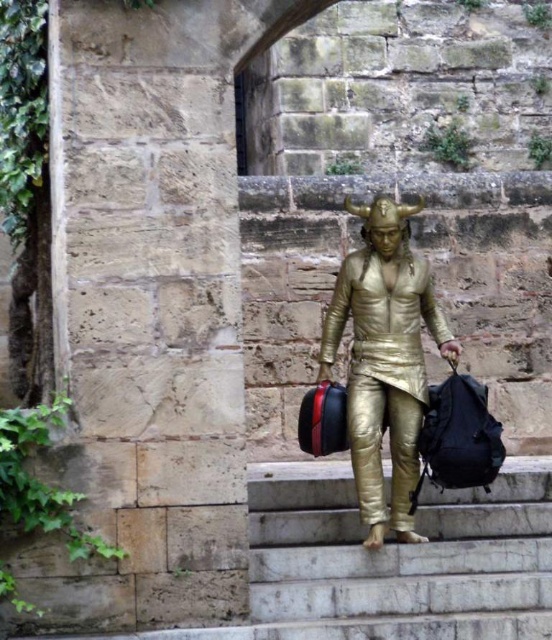
Between gold metallic suit at center and shiny metallic bag at center, which one has more height?

gold metallic suit at center is taller.

Which is more to the right, gold metallic suit at center or shiny metallic bag at center?

Positioned to the right is gold metallic suit at center.

Is point (392, 360) positioned before point (320, 449)?

Yes, it is.

The height and width of the screenshot is (640, 552). Find the location of `gold metallic suit at center`. gold metallic suit at center is located at coordinates (384, 358).

Which is in front, point (321, 372) or point (481, 442)?

Positioned in front is point (481, 442).

This screenshot has width=552, height=640. In order to click on gold metallic suit at center in this screenshot , I will do `click(384, 358)`.

Who is shorter, black fabric backpack at center or shiny metallic bag at center?

Standing shorter between the two is black fabric backpack at center.

Is black fabric backpack at center smaller than shiny metallic bag at center?

Yes.

The width and height of the screenshot is (552, 640). I want to click on black fabric backpack at center, so click(x=459, y=436).

The image size is (552, 640). Identify the location of black fabric backpack at center. (459, 436).